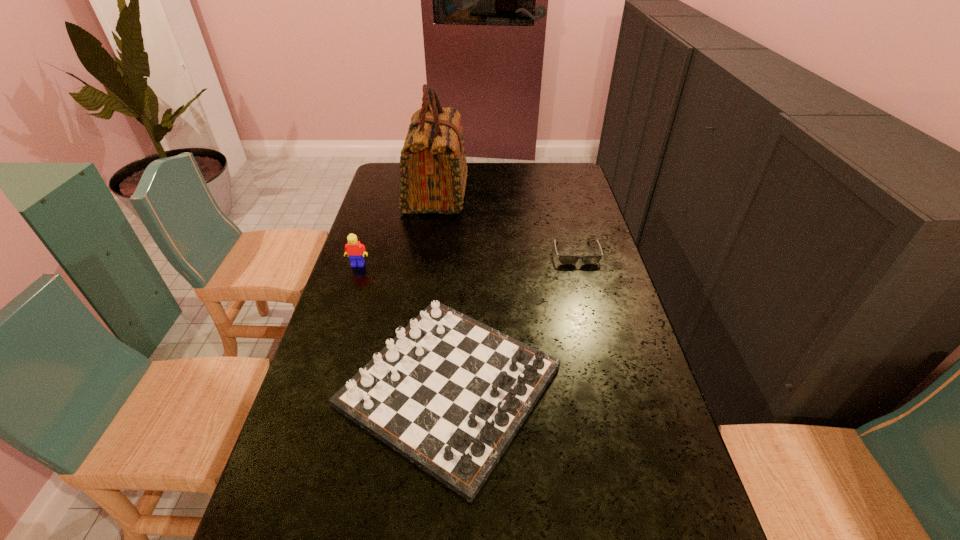
Find the location of a particular element. Image resolution: width=960 pixels, height=540 pixels. the farthest object is located at coordinates (433, 172).

Find the location of a particular element. the tallest object is located at coordinates [433, 172].

The image size is (960, 540). What are the coordinates of `the second tallest object` in the screenshot? It's located at (354, 249).

The height and width of the screenshot is (540, 960). I want to click on Lego, so click(x=354, y=249).

I want to click on the third tallest object, so click(449, 393).

Locate an element on the screen. the nearest object is located at coordinates (449, 393).

I want to click on sunglasses, so click(x=564, y=259).

Locate an element on the screen. The height and width of the screenshot is (540, 960). the rightmost object is located at coordinates (564, 259).

The width and height of the screenshot is (960, 540). I want to click on free point located on the open handle side of the shopping bag, so (553, 193).

Find the location of a particular element. The image size is (960, 540). blank area located on the front-facing side of the third shortest object is located at coordinates (341, 316).